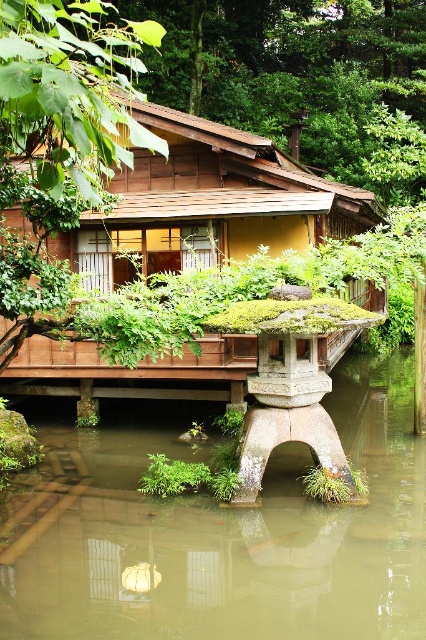
Question: Is green mossy stone at lower center to the right of wooden hut at center from the viewer's perspective?

Choices:
 (A) yes
 (B) no

Answer: (A)

Question: Is green mossy stone at lower center bigger than wooden hut at center?

Choices:
 (A) yes
 (B) no

Answer: (A)

Question: Which point is farther to the camera?

Choices:
 (A) wooden hut at center
 (B) green mossy stone at lower center

Answer: (A)

Question: Does green mossy stone at lower center appear on the left side of wooden hut at center?

Choices:
 (A) no
 (B) yes

Answer: (A)